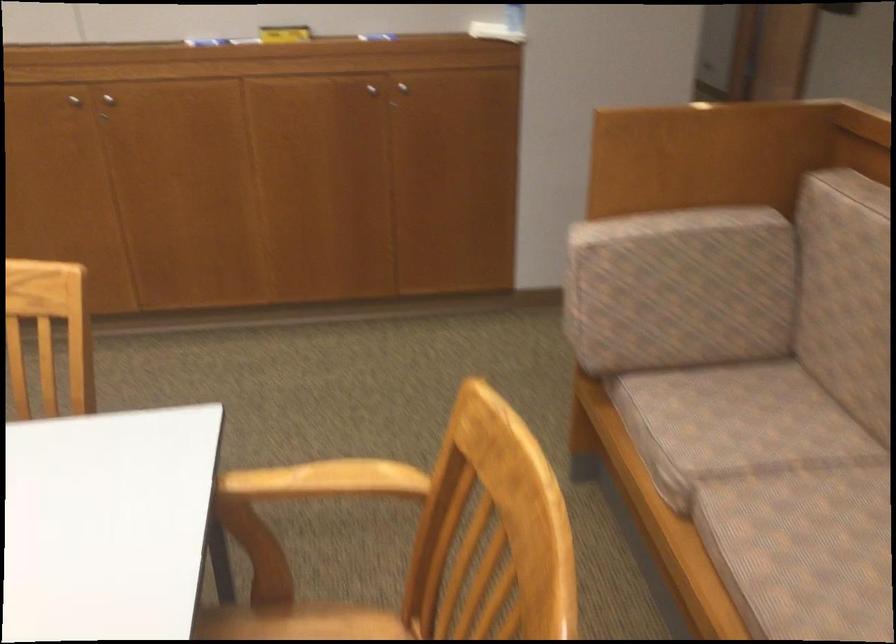
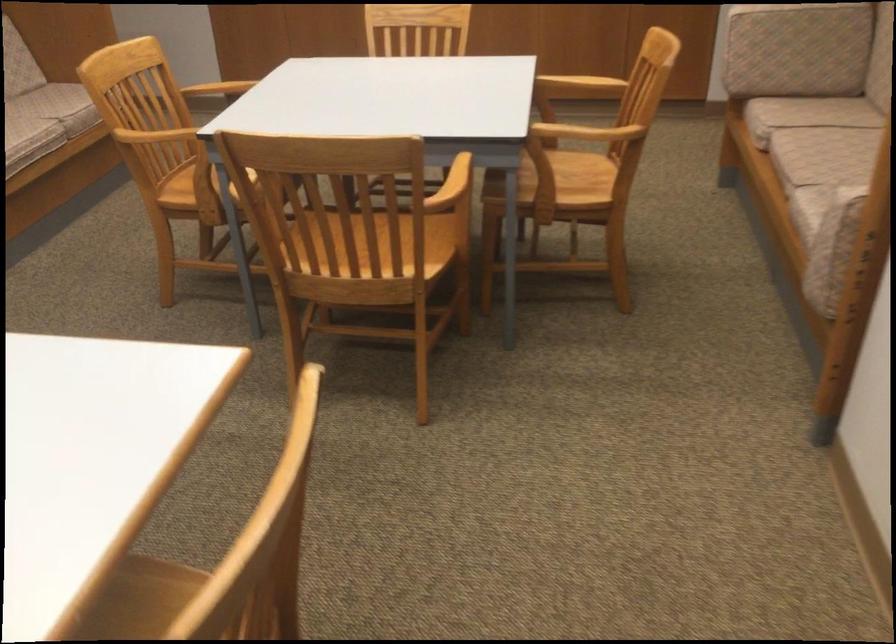
Where in the second image is the point corresponding to point 744,456 from the first image?

(807, 114)